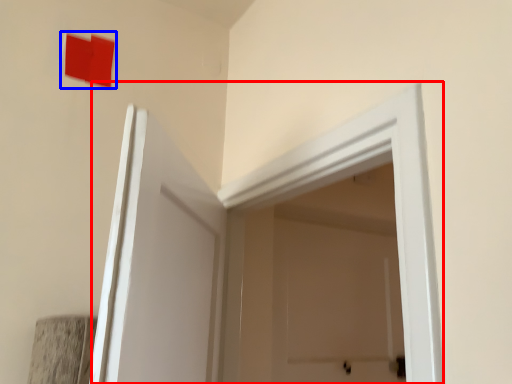
Question: Which of the following is the farthest to the observer, door (highlighted by a red box) or square (highlighted by a blue box)?

Choices:
 (A) door
 (B) square

Answer: (B)